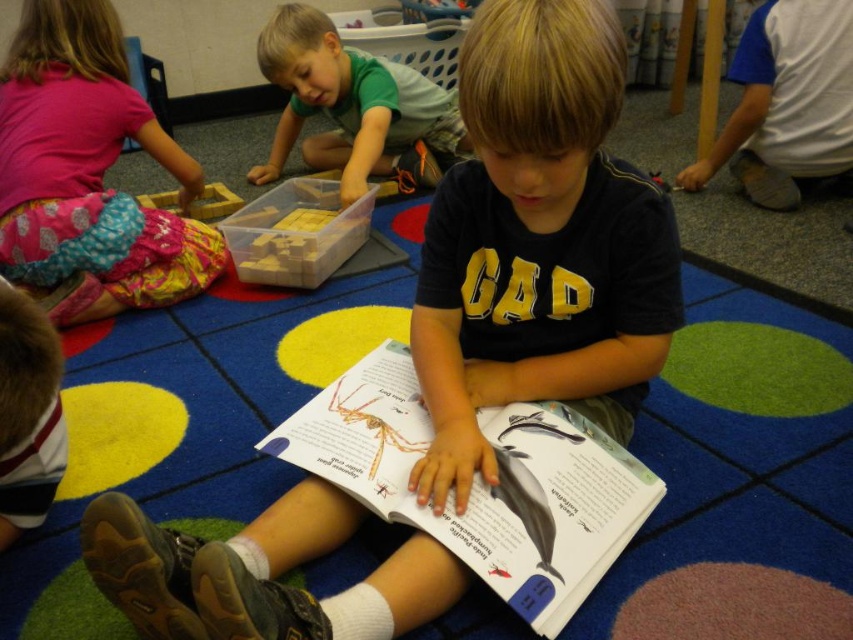
Question: Which of the following is the farthest from the observer?

Choices:
 (A) (74, 3)
 (B) (764, 166)

Answer: (B)

Question: Which point is closer to the camera?

Choices:
 (A) (404, 152)
 (B) (135, 134)
 (C) (467, 394)
 (D) (815, 92)

Answer: (C)

Question: Does white paper book at center appear under matte pink shirt at upper left?

Choices:
 (A) no
 (B) yes

Answer: (B)

Question: Is matte pink shirt at upper left below white cotton shirt at lower right?

Choices:
 (A) no
 (B) yes

Answer: (B)

Question: Which point is farther to the camera?

Choices:
 (A) (108, 250)
 (B) (392, 109)

Answer: (B)

Question: Does matte black shirt at center have a larger size compared to white cotton shirt at lower right?

Choices:
 (A) yes
 (B) no

Answer: (A)